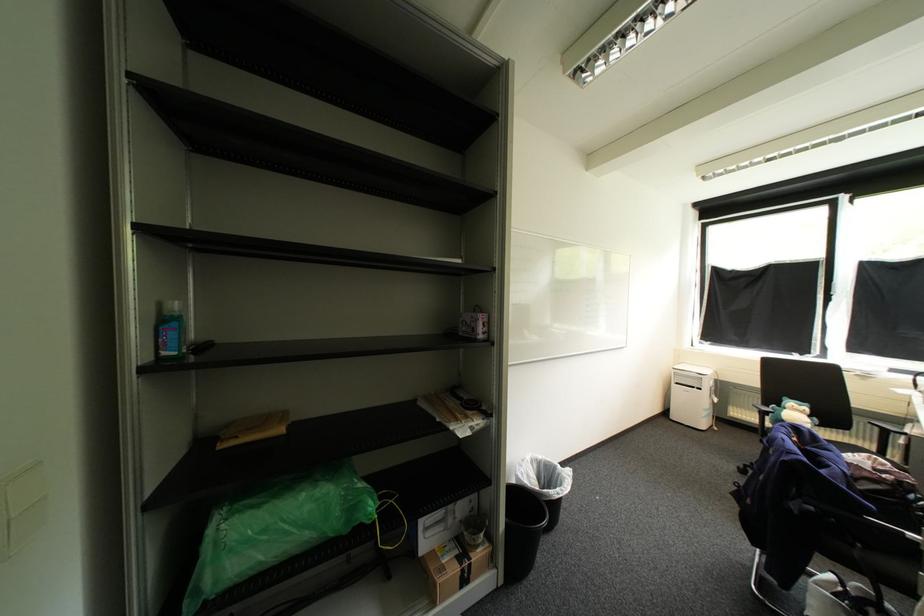
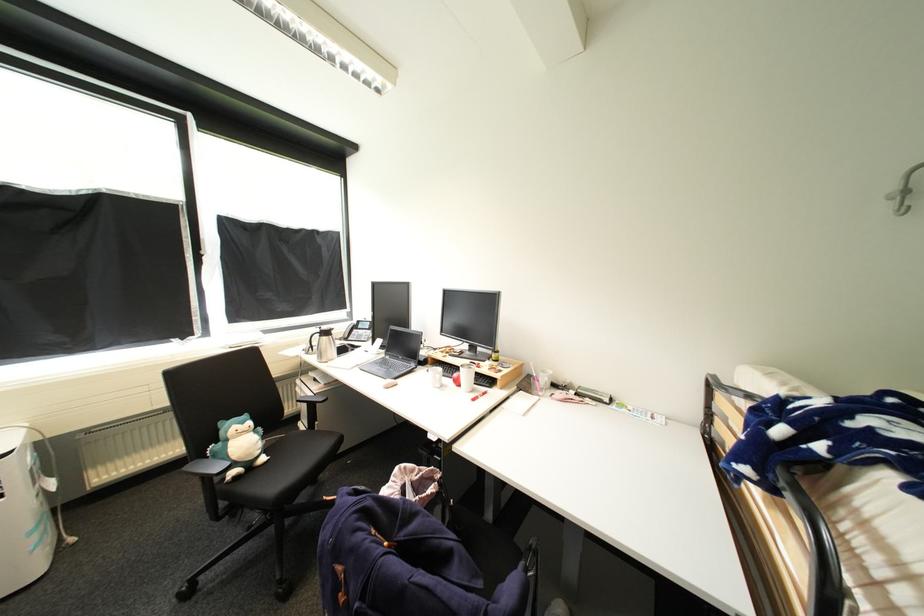
The point at (817,448) is marked in the first image. Where is the corresponding point in the second image?

(408, 537)